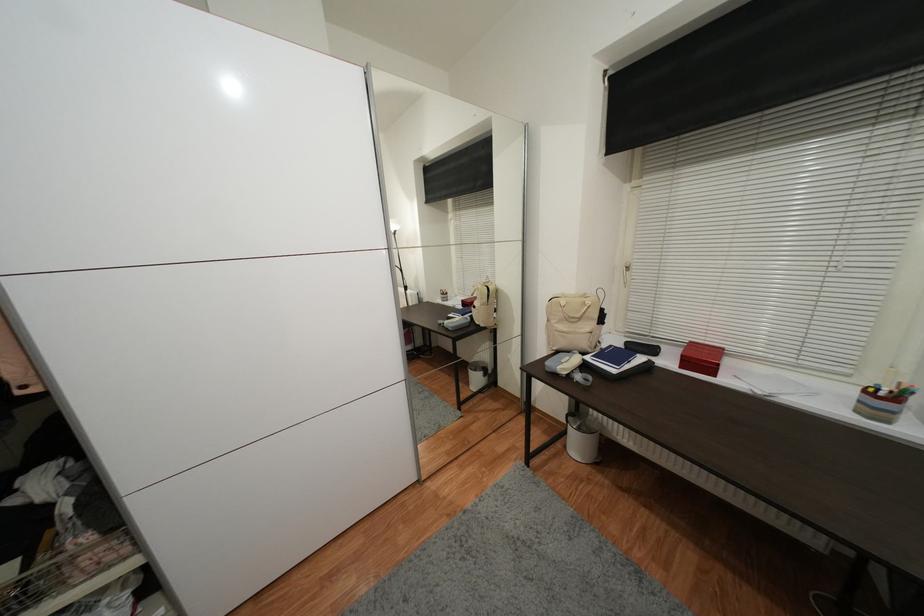
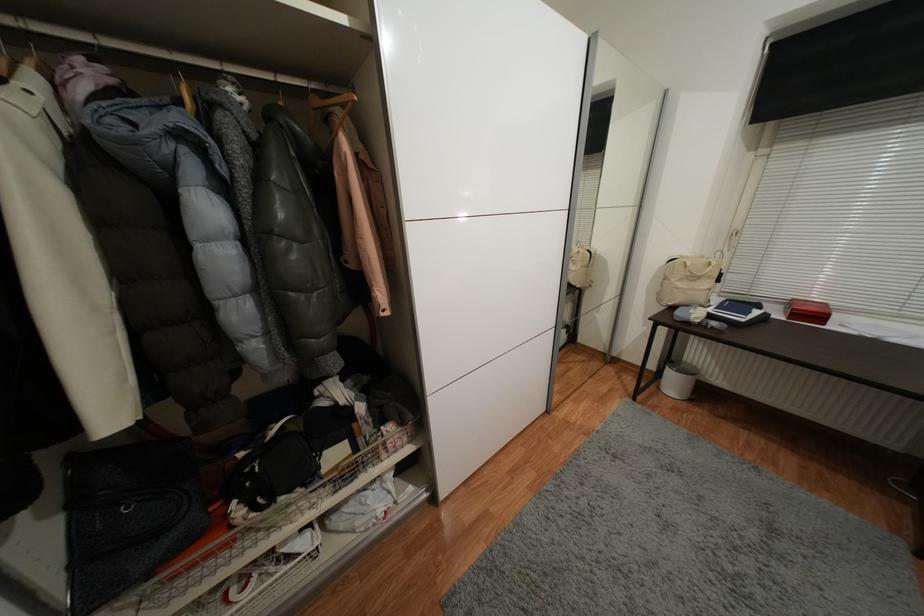
Locate, in the second image, the point that corresponds to [589,297] in the first image.

(707, 257)